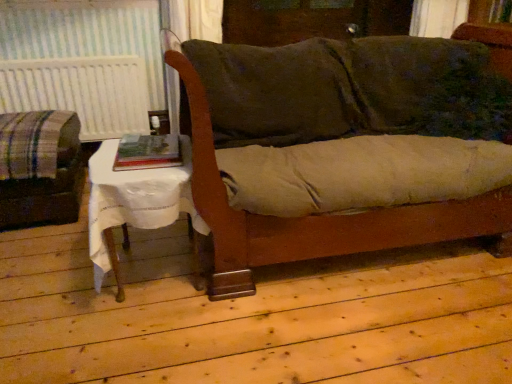
Locate an element on the screen. Image resolution: width=512 pixels, height=384 pixels. vacant space situated on the left part of white cloth-covered table at lower left is located at coordinates (49, 278).